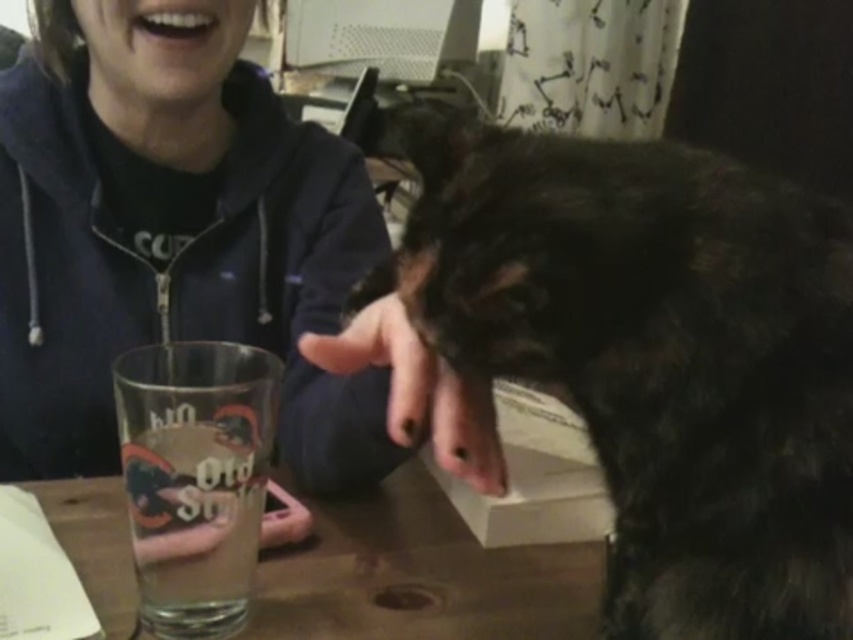
Question: Which object is farther from the camera taking this photo?

Choices:
 (A) matte black hoodie at center
 (B) clear glass at center
 (C) white glossy teeth at upper center
 (D) wooden table at center

Answer: (C)

Question: Is dark fur dog at center above clear glass at center?

Choices:
 (A) yes
 (B) no

Answer: (A)

Question: Estimate the real-world distances between objects in this image. Which object is farther from the wooden table at center?

Choices:
 (A) clear glass at center
 (B) dark fur dog at center

Answer: (B)

Question: Is dark fur dog at center below wooden table at center?

Choices:
 (A) yes
 (B) no

Answer: (B)

Question: Which object is closer to the camera taking this photo?

Choices:
 (A) wooden table at center
 (B) white glossy teeth at upper center
 (C) clear glass at center
 (D) matte black hoodie at center

Answer: (C)

Question: Does clear glass at center have a lesser width compared to white glossy teeth at upper center?

Choices:
 (A) no
 (B) yes

Answer: (A)